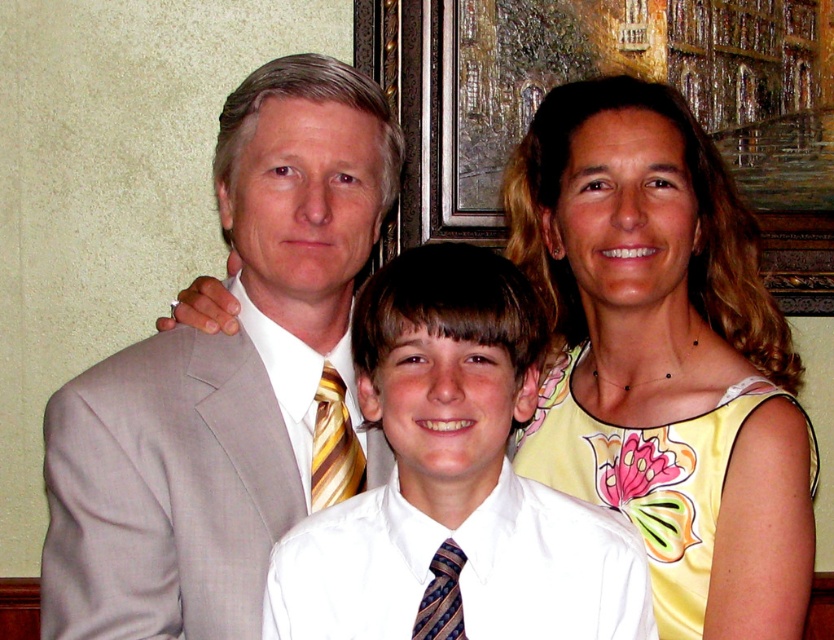
You are a photographer setting up for a group photo. You notice the yellow satin dress at upper right and the yellow striped tie at center. Which one is higher up in the image?

The yellow satin dress at upper right is positioned over the yellow striped tie at center, so it is higher up in the image.

You are a photographer arranging a group photo. You have a yellow satin dress at upper right and a yellow striped tie at center. Which one is more to the right?

The yellow satin dress at upper right is more to the right than the yellow striped tie at center.

You are a photographer setting up for a group photo. You notice the light gray suit at center and the yellow satin dress at upper right. Which one is positioned closer to the camera?

The yellow satin dress at upper right is closer to the camera because the light gray suit at center is behind it.